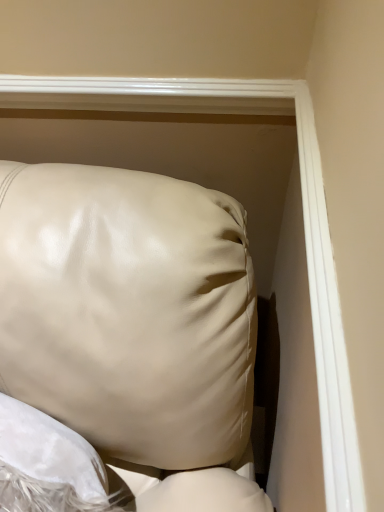
Describe the element at coordinates (134, 325) in the screenshot. I see `beige leather pillow at upper left` at that location.

At what (x,y) coordinates should I click in order to perform the action: click on beige leather pillow at upper left. Please return your answer as a coordinate pair (x, y). Image resolution: width=384 pixels, height=512 pixels. Looking at the image, I should click on (134, 325).

Identify the location of beige leather pillow at upper left. (134, 325).